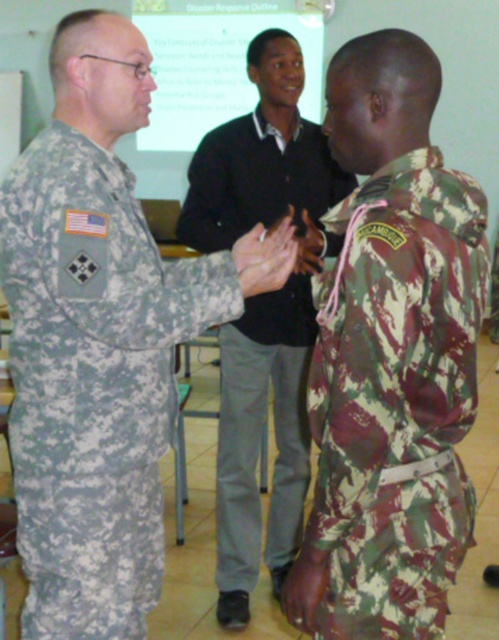
Question: Among these points, which one is nearest to the camera?

Choices:
 (A) (25, 163)
 (B) (413, 552)

Answer: (B)

Question: Which of the following is the closest to the observer?

Choices:
 (A) (120, 323)
 (B) (335, 170)

Answer: (A)

Question: Can you confirm if camouflage fabric uniform at left is positioned to the right of camouflage fabric uniform at right?

Choices:
 (A) no
 (B) yes

Answer: (A)

Question: Which is nearer to the camouflage fabric uniform at right?

Choices:
 (A) camouflage fabric uniform at left
 (B) camo fabric uniform at center

Answer: (A)

Question: Is camouflage fabric uniform at right thinner than camo fabric uniform at center?

Choices:
 (A) no
 (B) yes

Answer: (B)

Question: Can you confirm if camouflage fabric uniform at right is bigger than camo fabric uniform at center?

Choices:
 (A) no
 (B) yes

Answer: (A)